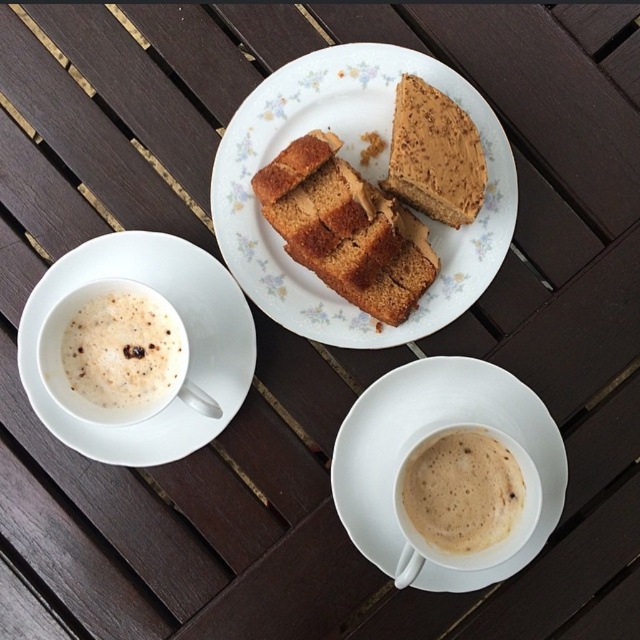
Can you confirm if white frothy coffee at upper left is positioned to the right of foamy white coffee at lower center?

No, white frothy coffee at upper left is not to the right of foamy white coffee at lower center.

Who is more forward, [113,337] or [413,525]?

Positioned in front is point [113,337].

This screenshot has height=640, width=640. I want to click on white frothy coffee at upper left, so click(x=122, y=348).

Which is in front, point (435, 586) or point (392, 138)?

Point (435, 586) is more forward.

Based on the photo, between white ceramic saucer at center and golden brown cake at center, which one has less height?

Standing shorter between the two is golden brown cake at center.

What do you see at coordinates (417, 445) in the screenshot? I see `white ceramic saucer at center` at bounding box center [417, 445].

The width and height of the screenshot is (640, 640). Identify the location of white ceramic saucer at center. (417, 445).

Is white ceramic saucer at left shorter than golden brown cake at center?

In fact, white ceramic saucer at left may be taller than golden brown cake at center.

Does white ceramic saucer at left have a larger size compared to golden brown cake at center?

Correct, white ceramic saucer at left is larger in size than golden brown cake at center.

The width and height of the screenshot is (640, 640). What do you see at coordinates (188, 340) in the screenshot?
I see `white ceramic saucer at left` at bounding box center [188, 340].

Locate an element on the screen. The height and width of the screenshot is (640, 640). white ceramic saucer at left is located at coordinates (188, 340).